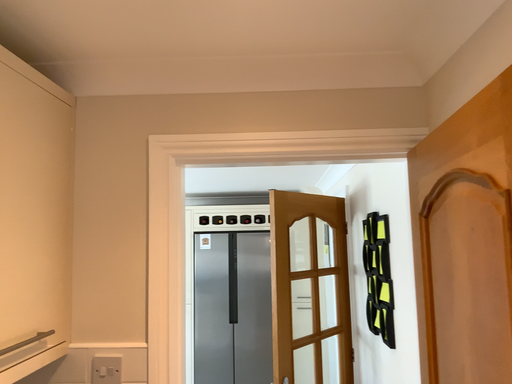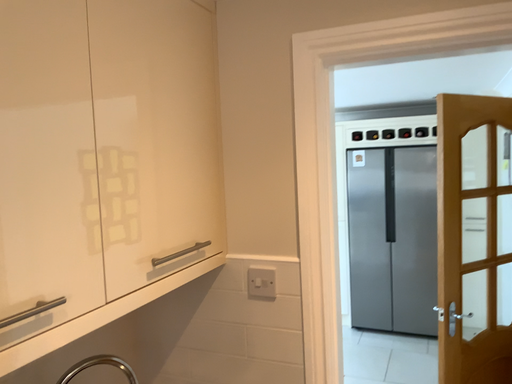
Question: How did the camera likely rotate when shooting the video?

Choices:
 (A) rotated downward
 (B) rotated upward

Answer: (A)